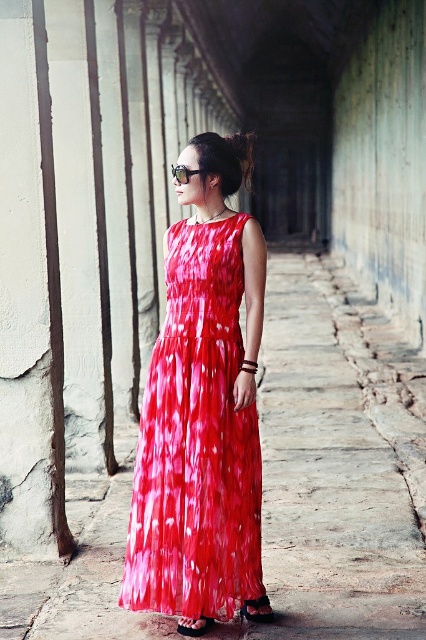
You are a photographer planning to take a portrait of the woman in the corridor. The corridor has a smooth stone pavement at center and a shiny silk dress at center. Which object is wider from your perspective?

The smooth stone pavement at center might be wider than the shiny silk dress at center according to the description.

You are a fashion designer observing the woman in the corridor. You need to determine if the distance between the shiny silk dress at center and the black leather sandal at center is sufficient to allow a 36 inch long measuring tape to be laid flat between them without bending. Can you confirm this?

The distance between the shiny silk dress at center and the black leather sandal at center is 38.24 inches, which is longer than the 36 inch measuring tape. Therefore, the measuring tape can be laid flat between them without bending.

You are a photographer standing in the corridor and want to capture the shiny silk dress at center. Where should you position yourself to ensure the dress is centered in your photo?

To center the shiny silk dress at center in your photo, position yourself directly in front of the dress at point coordinates (196, 442).